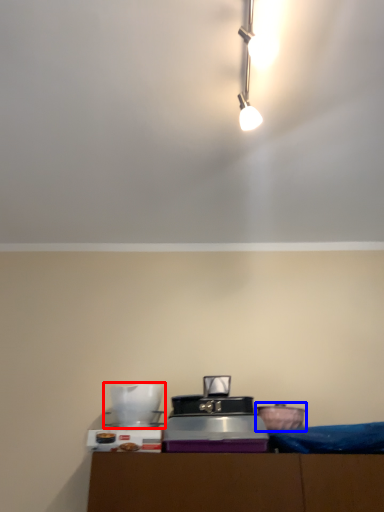
Question: Which of the following is the farthest to the observer, appliance (highlighted by a red box) or appliance (highlighted by a blue box)?

Choices:
 (A) appliance
 (B) appliance

Answer: (B)